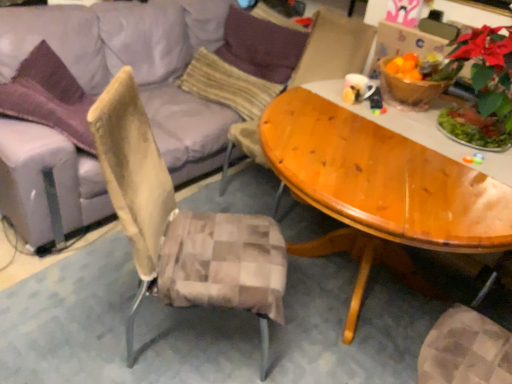
Question: Considering the positions of point (202, 81) and point (203, 144), is point (202, 81) closer or farther from the camera than point (203, 144)?

Choices:
 (A) closer
 (B) farther

Answer: (B)

Question: Is beige textured pillow at center, the first pillow ordered from the bottom, wider or thinner than light gray fabric couch at upper left?

Choices:
 (A) wide
 (B) thin

Answer: (B)

Question: Based on their relative distances, which object is farther from the beige textured pillow at center, the first pillow ordered from the bottom?

Choices:
 (A) green matte poinsettia at upper right
 (B) wooden chair at center
 (C) purple fabric pillow at upper center, which ranks as the 1th pillow in top-to-bottom order
 (D) light gray fabric couch at upper left

Answer: (A)

Question: Which is farther from the green matte poinsettia at upper right?

Choices:
 (A) wooden chair at center
 (B) purple fabric pillow at upper center, which ranks as the 1th pillow in top-to-bottom order
 (C) beige textured pillow at center, positioned as the 2th pillow in top-to-bottom order
 (D) light gray fabric couch at upper left

Answer: (D)